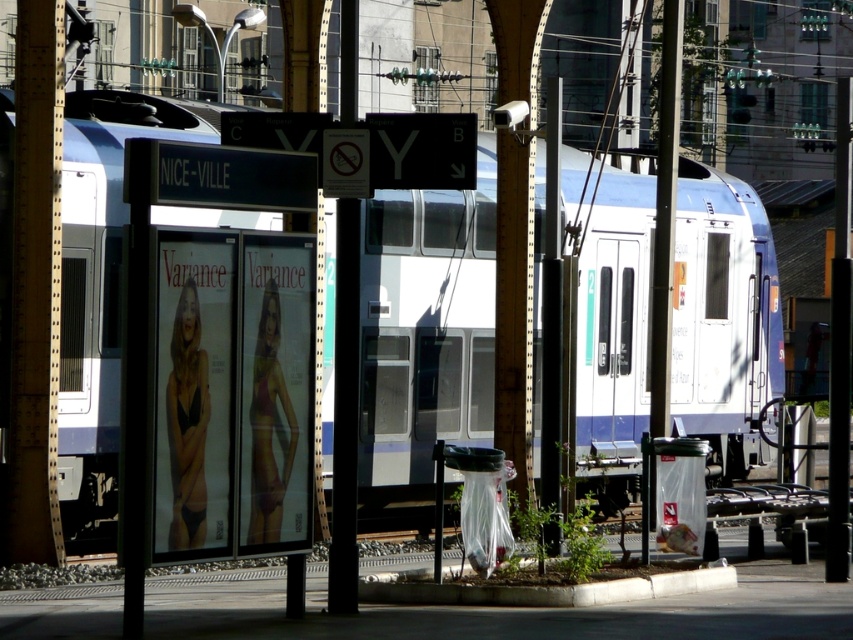
You are a passenger waiting at the train station. You see the white glossy train at center and the black metal pole at center. Which object is taller?

Answer: The white glossy train at center is taller than the black metal pole at center.

You are a delivery person who needs to place a 1.2 meter wide package between the clear glass bus stop at center and the black metal pole at center. Can the package fit between them?

The clear glass bus stop at center is wider than the black metal pole at center. However, the exact distance between them isn